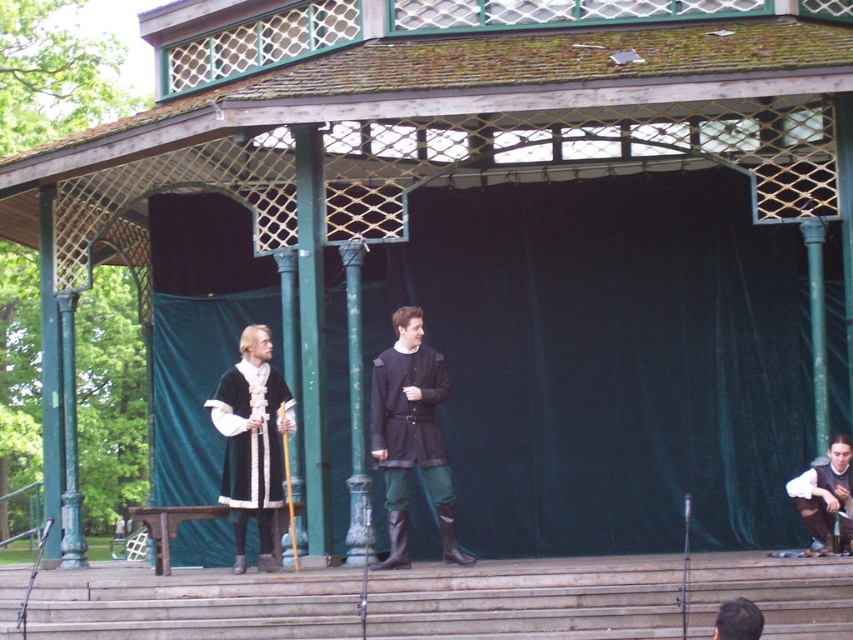
Question: Which point appears closest to the camera in this image?

Choices:
 (A) (728, 618)
 (B) (450, 515)
 (C) (846, 529)

Answer: (A)

Question: Can you confirm if dark brown leather boots at center is wider than brown leather pants at lower right?

Choices:
 (A) yes
 (B) no

Answer: (B)

Question: Which point appears farthest from the camera in this image?

Choices:
 (A) (260, 464)
 (B) (433, 392)

Answer: (B)

Question: Estimate the real-world distances between objects in this image. Which object is closer to the brown leather pants at lower right?

Choices:
 (A) dark brown leather boots at center
 (B) brown hair at lower right

Answer: (A)

Question: Can you confirm if dark brown leather boots at center is positioned below brown leather pants at lower right?

Choices:
 (A) yes
 (B) no

Answer: (B)

Question: Does dark brown leather boots at center have a greater width compared to velvet black robe at center?

Choices:
 (A) yes
 (B) no

Answer: (B)